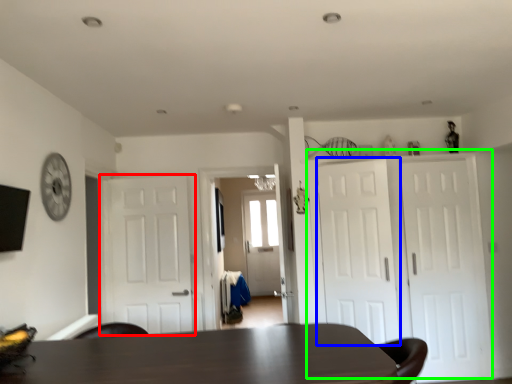
Question: Which is farther away from door (highlighted by a red box)? door (highlighted by a blue box) or door (highlighted by a green box)?

Choices:
 (A) door
 (B) door

Answer: (B)